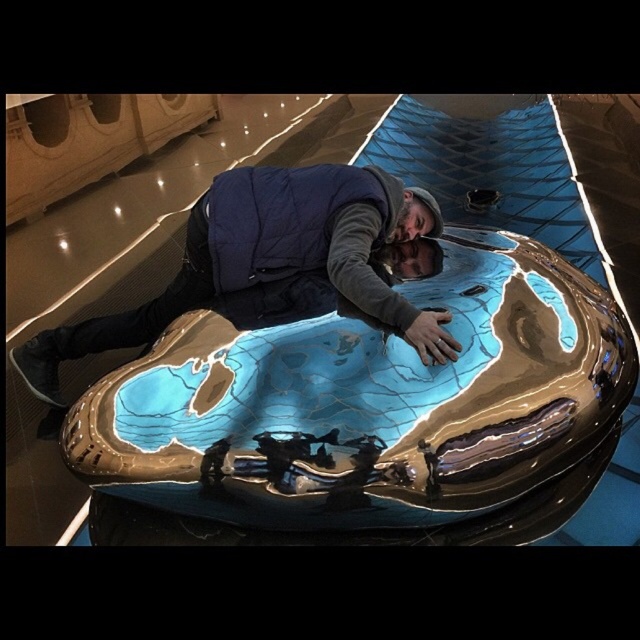
What do you see at coordinates (365, 403) in the screenshot? This screenshot has height=640, width=640. I see `metallic blue pool at center` at bounding box center [365, 403].

Is metallic blue pool at center wider than blue metallic man at center?

Indeed, metallic blue pool at center has a greater width compared to blue metallic man at center.

Image resolution: width=640 pixels, height=640 pixels. What do you see at coordinates (365, 403) in the screenshot? I see `metallic blue pool at center` at bounding box center [365, 403].

The image size is (640, 640). Identify the location of metallic blue pool at center. (365, 403).

Measure the distance between point [426,196] and camera.

The distance of point [426,196] from camera is 5.51 meters.

Does blue metallic man at center appear over navy blue down vest at center?

No.

Find the location of `blue metallic man at center`. blue metallic man at center is located at coordinates (269, 259).

This screenshot has height=640, width=640. Identify the location of blue metallic man at center. (269, 259).

Which of these two, metallic blue pool at center or navy blue down vest at center, stands shorter?

navy blue down vest at center is shorter.

Who is more distant from viewer, (524, 333) or (380, 204)?

Positioned behind is point (380, 204).

Locate an element on the screen. The image size is (640, 640). metallic blue pool at center is located at coordinates (365, 403).